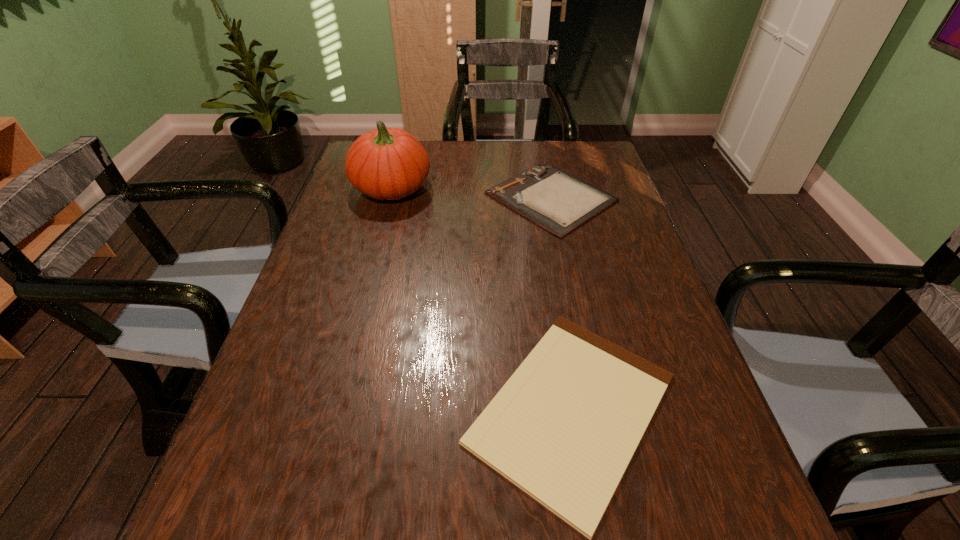
What are the coordinates of `pumpkin` in the screenshot? It's located at (387, 163).

At what (x,y) coordinates should I click in order to perform the action: click on the leftmost object. Please return your answer as a coordinate pair (x, y). Image resolution: width=960 pixels, height=540 pixels. Looking at the image, I should click on (387, 163).

Find the location of `the second tallest object`. the second tallest object is located at coordinates (557, 201).

This screenshot has width=960, height=540. I want to click on the farther clipboard, so click(x=557, y=201).

At what (x,y) coordinates should I click in order to perform the action: click on free space located on the front of the tallest object. Please return your answer as a coordinate pair (x, y). The height and width of the screenshot is (540, 960). Looking at the image, I should click on [356, 322].

The width and height of the screenshot is (960, 540). What are the coordinates of `vacant space located 0.210m on the front of the second tallest object` in the screenshot? It's located at (x=572, y=299).

Identify the location of pumpkin present at the far edge. (387, 163).

I want to click on clipboard located in the far edge section of the desktop, so click(557, 201).

In order to click on object located at the left edge in this screenshot , I will do `click(387, 163)`.

You are a GUI agent. You are given a task and a screenshot of the screen. Output one action in this format:
    pyautogui.click(x=<x>, y=<y>)
    Task: Click on the object present at the right edge
    Image resolution: width=960 pixels, height=540 pixels.
    Given the screenshot: What is the action you would take?
    pyautogui.click(x=557, y=201)